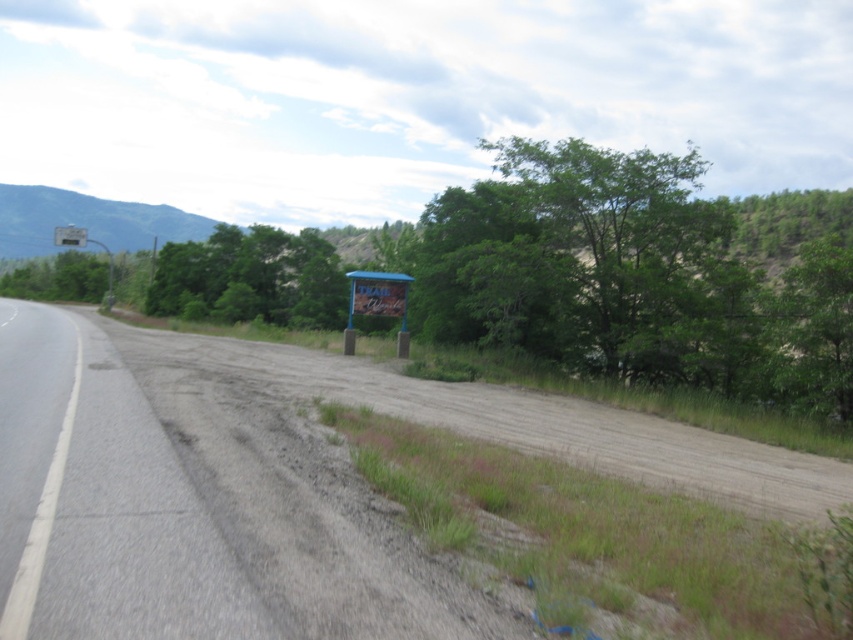
Question: From the image, what is the correct spatial relationship of metallic gray sign at upper left in relation to metallic blue sign at upper center?

Choices:
 (A) above
 (B) below

Answer: (B)

Question: Is asphalt road at left further to the viewer compared to metallic blue sign at upper center?

Choices:
 (A) no
 (B) yes

Answer: (A)

Question: Is blue plastic sign at center further to the viewer compared to metallic gray sign at upper left?

Choices:
 (A) no
 (B) yes

Answer: (A)

Question: Which is nearer to the asphalt road at left?

Choices:
 (A) metallic gray sign at upper left
 (B) metallic blue sign at upper center

Answer: (A)

Question: Among these objects, which one is farthest from the camera?

Choices:
 (A) asphalt road at left
 (B) metallic gray sign at upper left
 (C) blue plastic sign at center

Answer: (B)

Question: Based on their relative distances, which object is nearer to the asphalt road at left?

Choices:
 (A) blue plastic sign at center
 (B) metallic blue sign at upper center

Answer: (A)